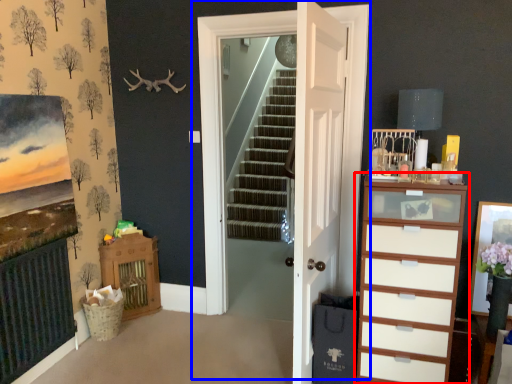
Question: Which of the following is the closest to the observer, chest of drawers (highlighted by a red box) or door (highlighted by a blue box)?

Choices:
 (A) chest of drawers
 (B) door

Answer: (A)